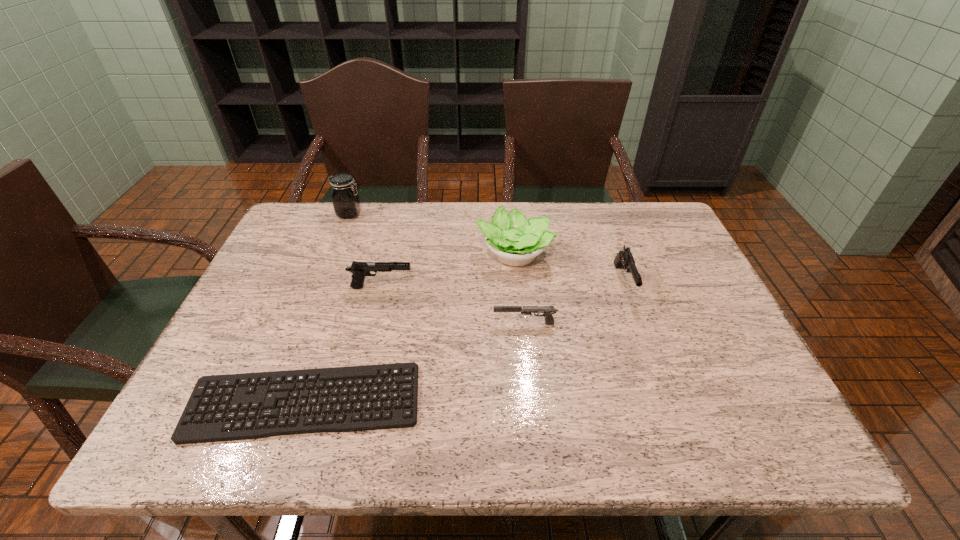
This screenshot has height=540, width=960. I want to click on jar present at the left edge, so click(346, 202).

Where is `computer keyboard at the left edge`? computer keyboard at the left edge is located at coordinates (205, 432).

Find the location of a particular element. Image resolution: width=960 pixels, height=540 pixels. object that is positioned at the far left corner is located at coordinates coord(346,202).

Find the location of a particular element. The width and height of the screenshot is (960, 540). object at the near left corner is located at coordinates (205, 432).

This screenshot has height=540, width=960. Identify the location of vacant area at the far edge. (515, 203).

Find the location of a particular element. Image resolution: width=960 pixels, height=540 pixels. vacant space at the right edge is located at coordinates (671, 311).

In the image, there is a desktop. At what (x,y) coordinates should I click in order to perform the action: click on vacant space at the far right corner. Please return your answer as a coordinate pair (x, y). This screenshot has width=960, height=540. Looking at the image, I should click on (629, 213).

Where is `free space between the leftmost gun and the rightmost gun`? free space between the leftmost gun and the rightmost gun is located at coordinates (503, 285).

The width and height of the screenshot is (960, 540). Identify the location of vacant area that lies between the lettuce and the rightmost gun. (568, 268).

The image size is (960, 540). I want to click on free space that is in between the leftmost gun and the rightmost gun, so click(x=503, y=285).